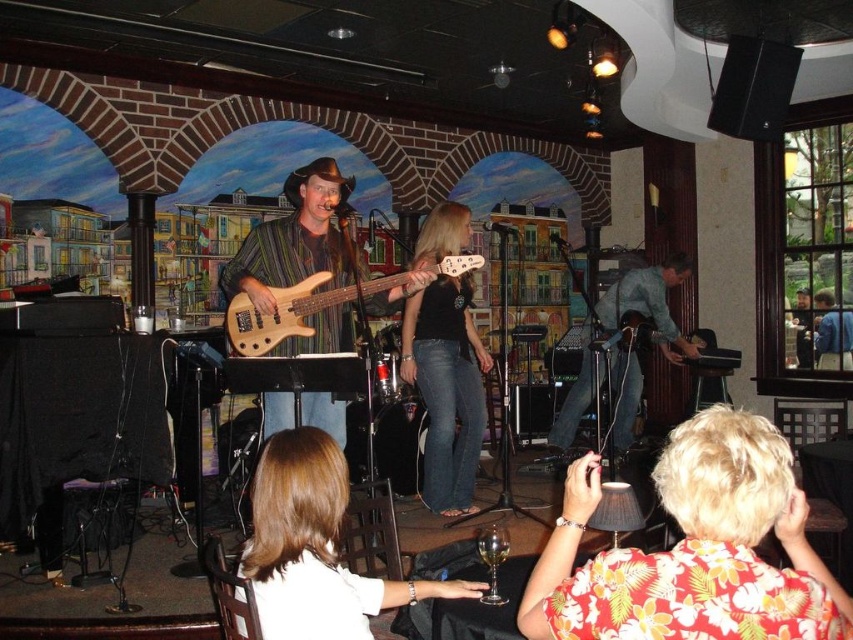
Does wooden bass guitar at center appear on the left side of black denim jeans at center?

Indeed, wooden bass guitar at center is positioned on the left side of black denim jeans at center.

Measure the distance from wooden bass guitar at center to black denim jeans at center.

wooden bass guitar at center and black denim jeans at center are 80.10 centimeters apart from each other.

This screenshot has width=853, height=640. Identify the location of wooden bass guitar at center. (297, 240).

Can you confirm if floral print shirt at lower right is shorter than wooden bass guitar at center?

Indeed, floral print shirt at lower right has a lesser height compared to wooden bass guitar at center.

Is floral print shirt at lower right to the right of wooden bass guitar at center from the viewer's perspective?

Yes, floral print shirt at lower right is to the right of wooden bass guitar at center.

You are a GUI agent. You are given a task and a screenshot of the screen. Output one action in this format:
    pyautogui.click(x=<x>, y=<y>)
    Task: Click on the floral print shirt at lower right
    
    Given the screenshot: What is the action you would take?
    pyautogui.click(x=693, y=548)

The width and height of the screenshot is (853, 640). I want to click on floral print shirt at lower right, so click(x=693, y=548).

Does blue denim jeans at center lie in front of natural wood electric bass at center?

That is False.

Can you confirm if blue denim jeans at center is positioned to the right of natural wood electric bass at center?

Correct, you'll find blue denim jeans at center to the right of natural wood electric bass at center.

Where is `blue denim jeans at center`? blue denim jeans at center is located at coordinates (648, 304).